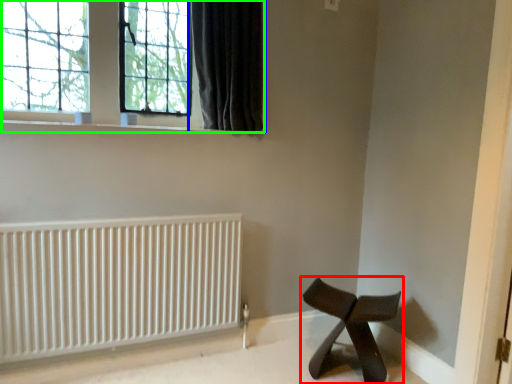
Question: Based on their relative distances, which object is nearer to furniture (highlighted by a red box)? Choose from curtain (highlighted by a blue box) and window (highlighted by a green box).

Choices:
 (A) curtain
 (B) window

Answer: (A)